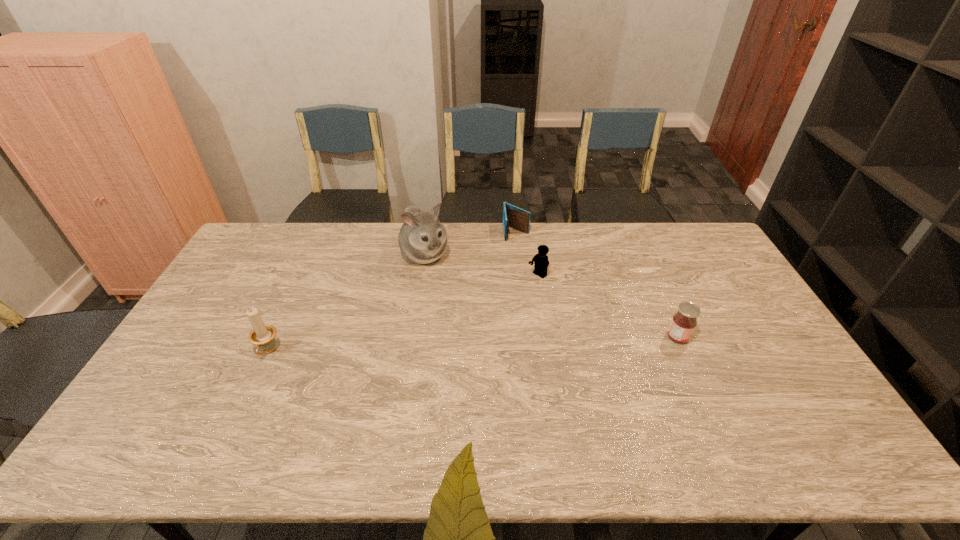
Identify the location of the second tallest object. The width and height of the screenshot is (960, 540). (262, 335).

This screenshot has height=540, width=960. I want to click on candle_holder, so click(262, 335).

What are the coordinates of `the rightmost object` in the screenshot? It's located at (684, 322).

Identify the location of Lego. This screenshot has width=960, height=540. (540, 260).

What are the coordinates of `hamster` in the screenshot? It's located at (422, 239).

The width and height of the screenshot is (960, 540). Identify the location of the tallest object. (422, 239).

You are a GUI agent. You are given a task and a screenshot of the screen. Output one action in this format:
    pyautogui.click(x=<x>, y=<y>)
    Task: Click on the shortest object
    The width and height of the screenshot is (960, 540).
    Given the screenshot: What is the action you would take?
    pyautogui.click(x=514, y=217)

Identify the location of vacant space positioned on the handle side of the candle_holder. Image resolution: width=960 pixels, height=540 pixels. (252, 387).

Identify the location of free region located 0.080m on the label side of the rightmost object. (716, 338).

The height and width of the screenshot is (540, 960). I want to click on vacant region located 0.220m on the front-facing side of the Lego, so click(487, 314).